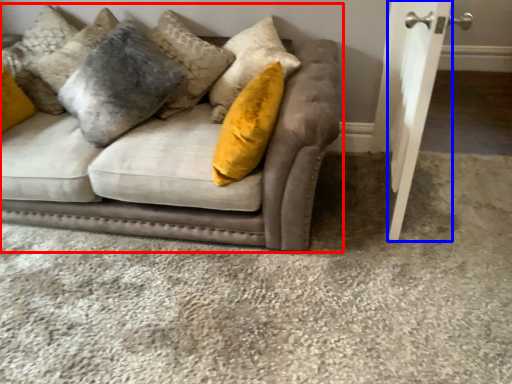
Question: Which point is closer to the camera, studio couch (highlighted by a red box) or door (highlighted by a blue box)?

Choices:
 (A) studio couch
 (B) door

Answer: (B)